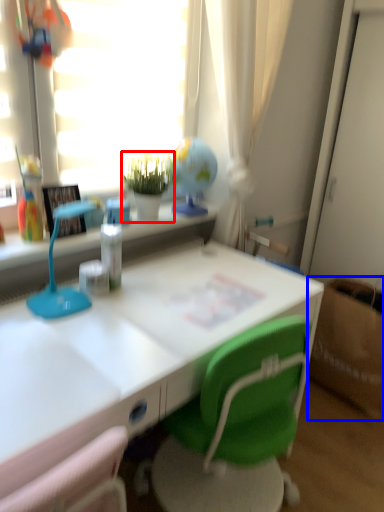
Question: Which point is further to the camera, houseplant (highlighted by a red box) or cardboard box (highlighted by a blue box)?

Choices:
 (A) houseplant
 (B) cardboard box

Answer: (B)